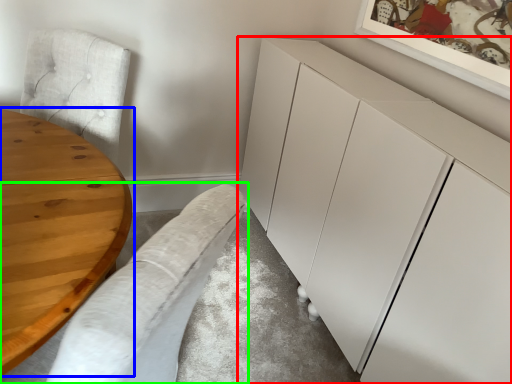
Question: Which object is positioned closest to cabinetry (highlighted by a red box)? Select from table (highlighted by a blue box) and couch (highlighted by a green box).

Choices:
 (A) table
 (B) couch

Answer: (B)